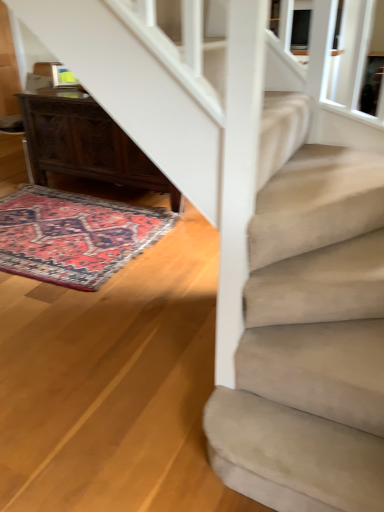
Image resolution: width=384 pixels, height=512 pixels. What do you see at coordinates (74, 234) in the screenshot?
I see `carpeted rug at lower left` at bounding box center [74, 234].

Locate an element on the screen. The height and width of the screenshot is (512, 384). carpeted rug at lower left is located at coordinates (74, 234).

This screenshot has width=384, height=512. What are the coordinates of `dark wood desk at lower left` in the screenshot? It's located at (85, 143).

Describe the element at coordinates (85, 143) in the screenshot. I see `dark wood desk at lower left` at that location.

Locate an element on the screen. Image resolution: width=384 pixels, height=512 pixels. carpeted rug at lower left is located at coordinates (74, 234).

Which is more to the left, dark wood desk at lower left or carpeted rug at lower left?

Positioned to the left is carpeted rug at lower left.

Based on the photo, which is in front, dark wood desk at lower left or carpeted rug at lower left?

Positioned in front is carpeted rug at lower left.

Considering the positions of point (79, 128) and point (134, 219), is point (79, 128) closer or farther from the camera than point (134, 219)?

Point (79, 128) appears to be farther away from the viewer than point (134, 219).

From the image's perspective, which is above, dark wood desk at lower left or carpeted rug at lower left?

dark wood desk at lower left is shown above in the image.

From a real-world perspective, is dark wood desk at lower left beneath carpeted rug at lower left?

No, from a real-world perspective, dark wood desk at lower left is not beneath carpeted rug at lower left.

Looking at their sizes, would you say dark wood desk at lower left is wider or thinner than carpeted rug at lower left?

Considering their sizes, dark wood desk at lower left looks slimmer than carpeted rug at lower left.

Consider the image. Who is taller, dark wood desk at lower left or carpeted rug at lower left?

With more height is dark wood desk at lower left.

Considering the relative sizes of dark wood desk at lower left and carpeted rug at lower left in the image provided, is dark wood desk at lower left bigger than carpeted rug at lower left?

Indeed, dark wood desk at lower left has a larger size compared to carpeted rug at lower left.

Is carpeted rug at lower left located within dark wood desk at lower left?

That's incorrect, carpeted rug at lower left is not inside dark wood desk at lower left.

Based on the photo, are dark wood desk at lower left and carpeted rug at lower left beside each other?

dark wood desk at lower left and carpeted rug at lower left are not in contact.

Is dark wood desk at lower left facing away from carpeted rug at lower left?

No, dark wood desk at lower left is not facing away from carpeted rug at lower left.

How many degrees apart are the facing directions of dark wood desk at lower left and carpeted rug at lower left?

There is a 177-degree angle between the facing directions of dark wood desk at lower left and carpeted rug at lower left.

How far apart are dark wood desk at lower left and carpeted rug at lower left?

They are 21.35 inches apart.

The image size is (384, 512). Identify the location of mat located on the left of dark wood desk at lower left. (74, 234).

Which is more to the right, carpeted rug at lower left or dark wood desk at lower left?

Positioned to the right is dark wood desk at lower left.

Which object is further away from the camera, carpeted rug at lower left or dark wood desk at lower left?

dark wood desk at lower left.

Between point (43, 232) and point (74, 146), which one is positioned behind?

The point (74, 146) is more distant.

From the image's perspective, is carpeted rug at lower left located above dark wood desk at lower left?

No, from the image's perspective, carpeted rug at lower left is not on top of dark wood desk at lower left.

From the picture: From a real-world perspective, is carpeted rug at lower left located higher than dark wood desk at lower left?

No, from a real-world perspective, carpeted rug at lower left is not on top of dark wood desk at lower left.

Is carpeted rug at lower left thinner than dark wood desk at lower left?

In fact, carpeted rug at lower left might be wider than dark wood desk at lower left.

Who is shorter, carpeted rug at lower left or dark wood desk at lower left?

carpeted rug at lower left.

Based on the photo, considering the relative sizes of carpeted rug at lower left and dark wood desk at lower left in the image provided, is carpeted rug at lower left bigger than dark wood desk at lower left?

No, carpeted rug at lower left is not bigger than dark wood desk at lower left.

Is carpeted rug at lower left spatially inside dark wood desk at lower left, or outside of it?

carpeted rug at lower left is not enclosed by dark wood desk at lower left.

Can you see carpeted rug at lower left touching dark wood desk at lower left?

carpeted rug at lower left is not next to dark wood desk at lower left, and they're not touching.

Is carpeted rug at lower left turned away from dark wood desk at lower left?

No, dark wood desk at lower left is not at the back of carpeted rug at lower left.

In the scene shown: How many degrees apart are the facing directions of carpeted rug at lower left and dark wood desk at lower left?

177 degrees.

Where is `mat in front of the dark wood desk at lower left`? mat in front of the dark wood desk at lower left is located at coordinates (74, 234).

The height and width of the screenshot is (512, 384). Identify the location of desk behind the carpeted rug at lower left. (85, 143).

Image resolution: width=384 pixels, height=512 pixels. In order to click on desk above the carpeted rug at lower left (from a real-world perspective) in this screenshot , I will do `click(85, 143)`.